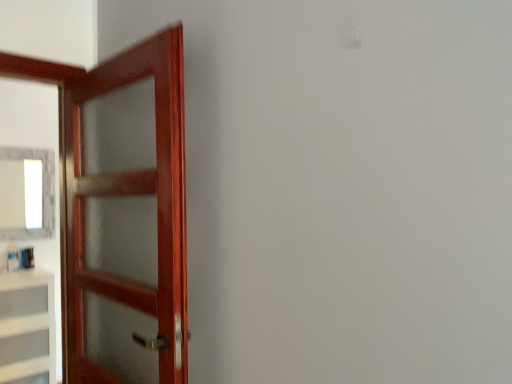
This screenshot has width=512, height=384. I want to click on white glossy mirror at upper left, so click(x=42, y=192).

What do you see at coordinates (27, 325) in the screenshot? I see `white matte cabinet at left` at bounding box center [27, 325].

Locate an element on the screen. mahogany wood door at left is located at coordinates (122, 195).

Describe the element at coordinates (122, 195) in the screenshot. The image size is (512, 384). I see `mahogany wood door at left` at that location.

Identify the location of white glossy mirror at upper left. (42, 192).

Is white matte cabinet at left facing away from mahogany wood door at left?

white matte cabinet at left does not have its back to mahogany wood door at left.

Can you confirm if white matte cabinet at left is smaller than mahogany wood door at left?

No.

Which of these two, white matte cabinet at left or mahogany wood door at left, stands taller?

mahogany wood door at left.

Is point (29, 285) in front of point (64, 370)?

No, (29, 285) is further to viewer.

Is white glossy mirror at upper left at the right side of white matte cabinet at left?

No, white glossy mirror at upper left is not to the right of white matte cabinet at left.

How many degrees apart are the facing directions of white glossy mirror at upper left and white matte cabinet at left?

There is a 2.1-degree angle between the facing directions of white glossy mirror at upper left and white matte cabinet at left.

Is there a large distance between white glossy mirror at upper left and white matte cabinet at left?

white glossy mirror at upper left is actually quite close to white matte cabinet at left.

Which object is further away from the camera, white glossy mirror at upper left or white matte cabinet at left?

Positioned behind is white glossy mirror at upper left.

Is mahogany wood door at left facing away from white glossy mirror at upper left?

mahogany wood door at left does not have its back to white glossy mirror at upper left.

Consider the image. Is mahogany wood door at left in contact with white glossy mirror at upper left?

mahogany wood door at left and white glossy mirror at upper left are not in contact.

Looking at this image, from the image's perspective, is mahogany wood door at left located beneath white glossy mirror at upper left?

Yes, from the image's perspective, mahogany wood door at left is below white glossy mirror at upper left.

From the image's perspective, which one is positioned higher, white matte cabinet at left or white glossy mirror at upper left?

white glossy mirror at upper left, from the image's perspective.

From a real-world perspective, is white matte cabinet at left physically located above or below white glossy mirror at upper left?

From a real-world perspective, white matte cabinet at left is physically below white glossy mirror at upper left.

Image resolution: width=512 pixels, height=384 pixels. Find the location of `mirror positioned vertically above the white matte cabinet at left (from a real-world perspective)`. mirror positioned vertically above the white matte cabinet at left (from a real-world perspective) is located at coordinates (42, 192).

Based on their positions, is white matte cabinet at left located to the left or right of white glossy mirror at upper left?

In the image, white matte cabinet at left appears on the right side of white glossy mirror at upper left.

Between white glossy mirror at upper left and mahogany wood door at left, which one has larger size?

mahogany wood door at left is bigger.

Which is behind, point (24, 156) or point (163, 46)?

Point (24, 156)

From the picture: From the image's perspective, is white glossy mirror at upper left over mahogany wood door at left?

Correct, white glossy mirror at upper left appears higher than mahogany wood door at left in the image.

From a real-world perspective, is white glossy mirror at upper left positioned above or below mahogany wood door at left?

white glossy mirror at upper left is situated higher than mahogany wood door at left in the real world.

Is mahogany wood door at left aimed at white matte cabinet at left?

No, mahogany wood door at left is not aimed at white matte cabinet at left.

Is point (89, 194) farther from camera compared to point (2, 365)?

That is False.

From the picture: Does mahogany wood door at left have a greater height compared to white matte cabinet at left?

Correct, mahogany wood door at left is much taller as white matte cabinet at left.

Would you say mahogany wood door at left is inside or outside white matte cabinet at left?

mahogany wood door at left is not enclosed by white matte cabinet at left.

The height and width of the screenshot is (384, 512). I want to click on cabinetry behind the mahogany wood door at left, so click(27, 325).

I want to click on cabinetry in front of the white glossy mirror at upper left, so click(x=27, y=325).

Considering their positions, is white matte cabinet at left positioned closer to mahogany wood door at left than white glossy mirror at upper left?

Among the two, white matte cabinet at left is located nearer to mahogany wood door at left.

Looking at the image, which one is located further to mahogany wood door at left, white glossy mirror at upper left or white matte cabinet at left?

white glossy mirror at upper left is positioned further to the anchor mahogany wood door at left.

Which object lies nearer to the anchor point white matte cabinet at left, white glossy mirror at upper left or mahogany wood door at left?

white glossy mirror at upper left lies closer to white matte cabinet at left than the other object.

From the image, which object appears to be nearer to white matte cabinet at left, mahogany wood door at left or white glossy mirror at upper left?

white glossy mirror at upper left is closer to white matte cabinet at left.

When comparing their distances from white glossy mirror at upper left, does mahogany wood door at left or white matte cabinet at left seem closer?

Among the two, white matte cabinet at left is located nearer to white glossy mirror at upper left.

When comparing their distances from white glossy mirror at upper left, does white matte cabinet at left or mahogany wood door at left seem further?

mahogany wood door at left is positioned further to the anchor white glossy mirror at upper left.

Where is `cabinetry between mahogany wood door at left and white glossy mirror at upper left from front to back`? cabinetry between mahogany wood door at left and white glossy mirror at upper left from front to back is located at coordinates (27, 325).